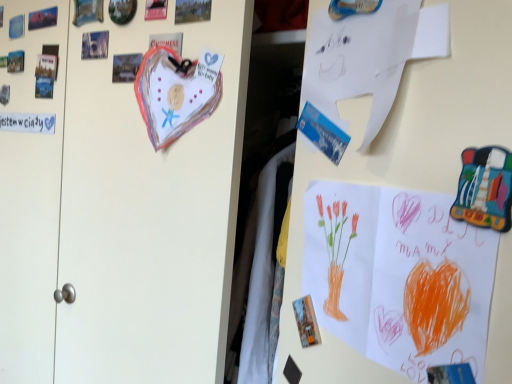
What do you see at coordinates (369, 56) in the screenshot? The width and height of the screenshot is (512, 384). I see `white paper at upper center` at bounding box center [369, 56].

I want to click on white paper at upper center, so click(369, 56).

Image resolution: width=512 pixels, height=384 pixels. Identify the location of orange crayon drawing at lower right. (399, 276).

Image resolution: width=512 pixels, height=384 pixels. What do you see at coordinates (399, 276) in the screenshot? I see `orange crayon drawing at lower right` at bounding box center [399, 276].

You are a GUI agent. You are given a task and a screenshot of the screen. Output one action in this format:
    pyautogui.click(x=<x>, y=<y>)
    Task: Click on the white paper at upper center
    The width and height of the screenshot is (512, 384).
    Given the screenshot: What is the action you would take?
    pyautogui.click(x=369, y=56)

Is white paper at upper center to the right of orange crayon drawing at lower right from the viewer's perspective?

Incorrect, white paper at upper center is not on the right side of orange crayon drawing at lower right.

Between white paper at upper center and orange crayon drawing at lower right, which one is positioned behind?

white paper at upper center.

Considering the points (323, 12) and (386, 313), which point is in front, point (323, 12) or point (386, 313)?

The point (386, 313) is closer.

From the image's perspective, is white paper at upper center under orange crayon drawing at lower right?

No.

From a real-world perspective, between white paper at upper center and orange crayon drawing at lower right, who is vertically higher?

From a 3D spatial view, white paper at upper center is above.

Can you confirm if white paper at upper center is wider than orange crayon drawing at lower right?

Indeed, white paper at upper center has a greater width compared to orange crayon drawing at lower right.

Which of these two, white paper at upper center or orange crayon drawing at lower right, stands taller?

With more height is orange crayon drawing at lower right.

Does white paper at upper center have a smaller size compared to orange crayon drawing at lower right?

Incorrect, white paper at upper center is not smaller in size than orange crayon drawing at lower right.

Would you say white paper at upper center contains orange crayon drawing at lower right?

Definitely not — orange crayon drawing at lower right is not inside white paper at upper center.

Is white paper at upper center with orange crayon drawing at lower right?

No, white paper at upper center is not in contact with orange crayon drawing at lower right.

In the scene shown: Could you tell me if white paper at upper center is facing orange crayon drawing at lower right?

No, white paper at upper center does not turn towards orange crayon drawing at lower right.

Can you tell me how much white paper at upper center and orange crayon drawing at lower right differ in facing direction?

The angle between the facing direction of white paper at upper center and the facing direction of orange crayon drawing at lower right is 89.7 degrees.

Measure the distance between white paper at upper center and orange crayon drawing at lower right.

white paper at upper center and orange crayon drawing at lower right are 6.66 inches apart.

The width and height of the screenshot is (512, 384). In order to click on paper on the left of orange crayon drawing at lower right in this screenshot , I will do point(369,56).

Can you confirm if orange crayon drawing at lower right is positioned to the left of white paper at upper center?

Incorrect, orange crayon drawing at lower right is not on the left side of white paper at upper center.

Does orange crayon drawing at lower right lie in front of white paper at upper center?

Yes, orange crayon drawing at lower right is closer to the viewer.

Does point (311, 277) appear closer or farther from the camera than point (434, 34)?

Point (311, 277) is farther from the camera than point (434, 34).

From the image's perspective, is orange crayon drawing at lower right positioned above or below white paper at upper center?

orange crayon drawing at lower right is situated lower than white paper at upper center in the image.

From a real-world perspective, is orange crayon drawing at lower right beneath white paper at upper center?

Yes, from a real-world perspective, orange crayon drawing at lower right is under white paper at upper center.

Which of these two, orange crayon drawing at lower right or white paper at upper center, is thinner?

Thinner between the two is orange crayon drawing at lower right.

Considering the relative sizes of orange crayon drawing at lower right and white paper at upper center in the image provided, is orange crayon drawing at lower right shorter than white paper at upper center?

In fact, orange crayon drawing at lower right may be taller than white paper at upper center.

Based on their sizes in the image, would you say orange crayon drawing at lower right is bigger or smaller than white paper at upper center?

Clearly, orange crayon drawing at lower right is smaller in size than white paper at upper center.

Is orange crayon drawing at lower right completely or partially outside of white paper at upper center?

Yes, orange crayon drawing at lower right is outside of white paper at upper center.

Would you say orange crayon drawing at lower right is a long distance from white paper at upper center?

They are positioned close to each other.

Is orange crayon drawing at lower right positioned with its back to white paper at upper center?

orange crayon drawing at lower right does not have its back to white paper at upper center.

How many degrees apart are the facing directions of orange crayon drawing at lower right and white paper at upper center?

They differ by 89.7 degrees in their facing directions.

Measure the distance between orange crayon drawing at lower right and white paper at upper center.

orange crayon drawing at lower right and white paper at upper center are 6.66 inches apart.

At what (x,y) coordinates should I click in order to perform the action: click on paper above the orange crayon drawing at lower right (from a real-world perspective). Please return your answer as a coordinate pair (x, y). Looking at the image, I should click on (369, 56).

At what (x,y) coordinates should I click in order to perform the action: click on paper located above the orange crayon drawing at lower right (from the image's perspective). Please return your answer as a coordinate pair (x, y). The width and height of the screenshot is (512, 384). Looking at the image, I should click on (369, 56).

At what (x,y) coordinates should I click in order to perform the action: click on poster on the right of white paper at upper center. Please return your answer as a coordinate pair (x, y). Looking at the image, I should click on (399, 276).